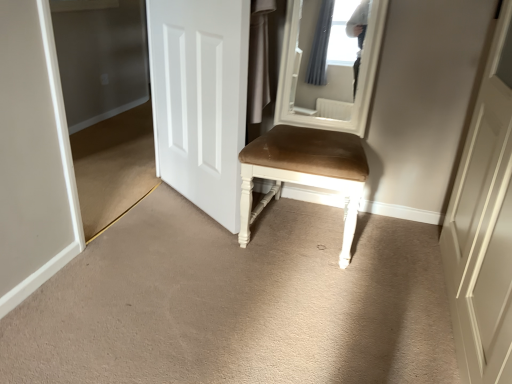
Locate an element on the screen. Image resolution: width=512 pixels, height=384 pixels. vacant area located to the right-hand side of suede-like brown chair at center is located at coordinates (397, 246).